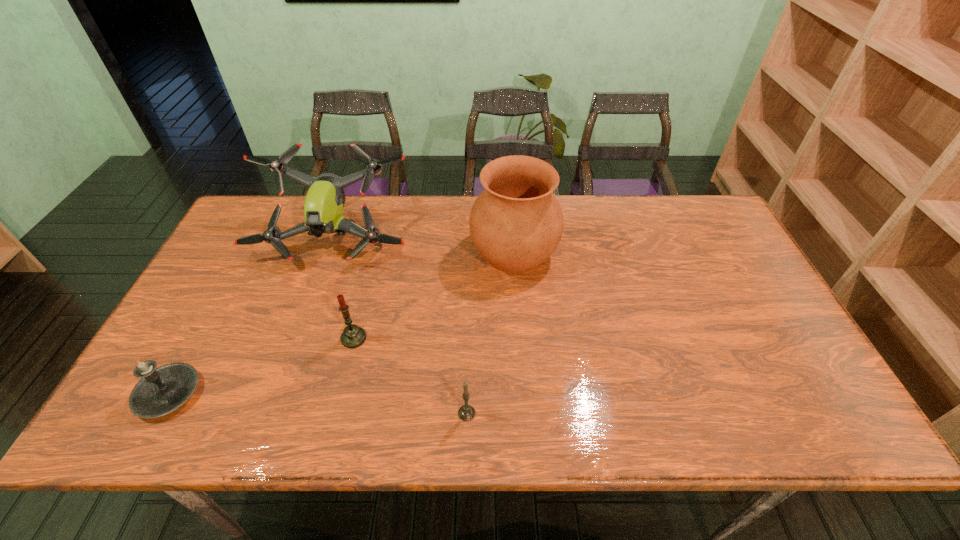
Where is `pottery`? The width and height of the screenshot is (960, 540). pottery is located at coordinates (516, 223).

At what (x,y) coordinates should I click in order to perform the action: click on drone. Please return your answer as a coordinate pair (x, y). Looking at the image, I should click on (323, 208).

Identify the location of the tallest candle. This screenshot has height=540, width=960. (353, 336).

At what (x,y) coordinates should I click in order to perform the action: click on the third nearest object. Please return your answer as a coordinate pair (x, y). This screenshot has width=960, height=540. Looking at the image, I should click on (353, 336).

Identify the location of the leftmost candle. This screenshot has height=540, width=960. (161, 390).

Where is `the rightmost candle`? the rightmost candle is located at coordinates pos(466,413).

Locate an element on the screen. This screenshot has width=960, height=540. vacant point located 0.390m on the front of the pottery is located at coordinates (527, 414).

At what (x,y) coordinates should I click in order to perform the action: click on vacant point located 0.280m on the front-facing side of the drone. Please return your answer as a coordinate pair (x, y). Looking at the image, I should click on (296, 353).

Where is `vacant space located on the right of the second candle from right to left`? The height and width of the screenshot is (540, 960). vacant space located on the right of the second candle from right to left is located at coordinates (410, 338).

Locate an element on the screen. This screenshot has width=960, height=540. vacant space located 0.130m on the right of the leftmost candle is located at coordinates (256, 394).